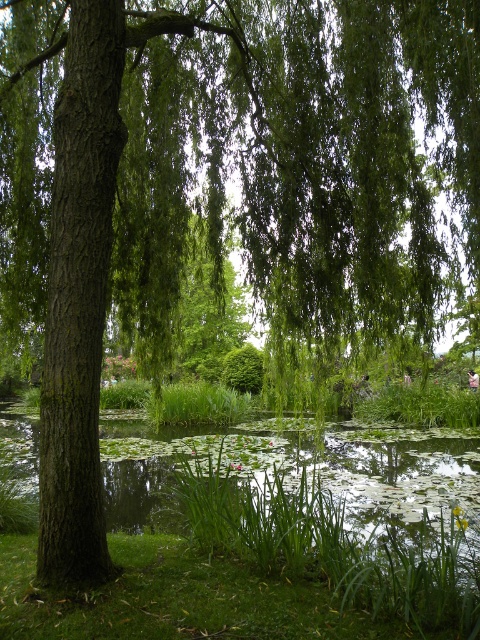
Consider the image. You are standing at the edge of the green grassy lake at lower left. Which direction should you walk to reach the point marked at coordinates point (298, 465)?

The green grassy lake at lower left is already located at point (298, 465), so you are already at the desired coordinates.

Based on the photo, you are standing at the edge of the green grass at lower center and want to step onto the green grassy lake at lower left. Is this possible?

The green grassy lake at lower left is positioned under the green grass at lower center, so stepping onto it would require moving downward from the grass at lower center, but since it is a lake, it is water and not solid ground, making it impossible to step onto.